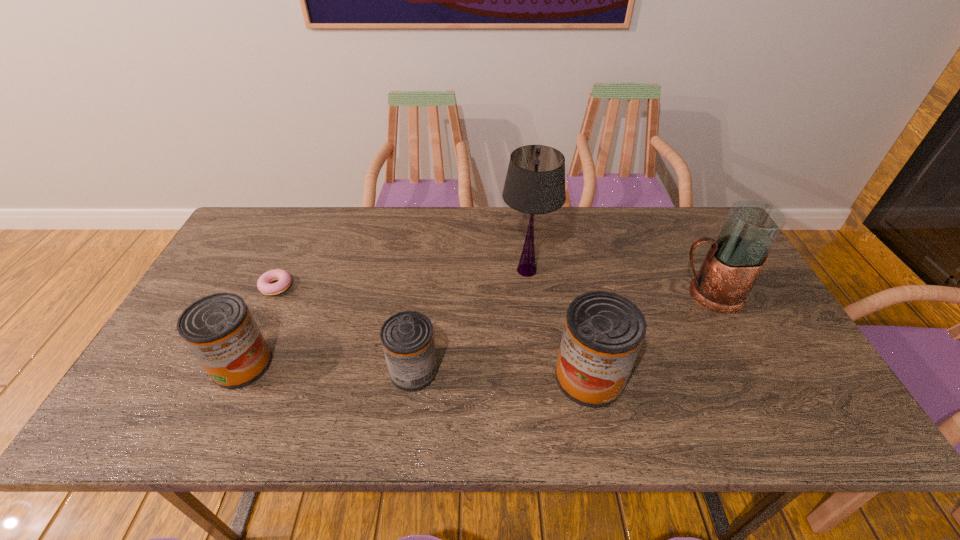
Please point a spot on the right to add another can. Please provide its 2D coordinates. Your answer should be formatted as a tuple, i.e. [(x, y)], where the tuple contains the x and y coordinates of a point satisfying the conditions above.

[(770, 384)]